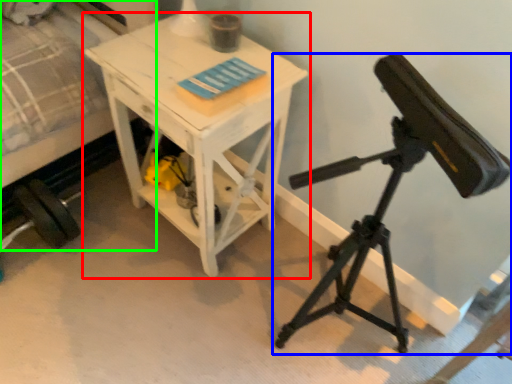
Question: Based on their relative distances, which object is farther from table (highlighted by a red box)? Choose from tripod (highlighted by a blue box) and bed (highlighted by a green box).

Choices:
 (A) tripod
 (B) bed

Answer: (A)